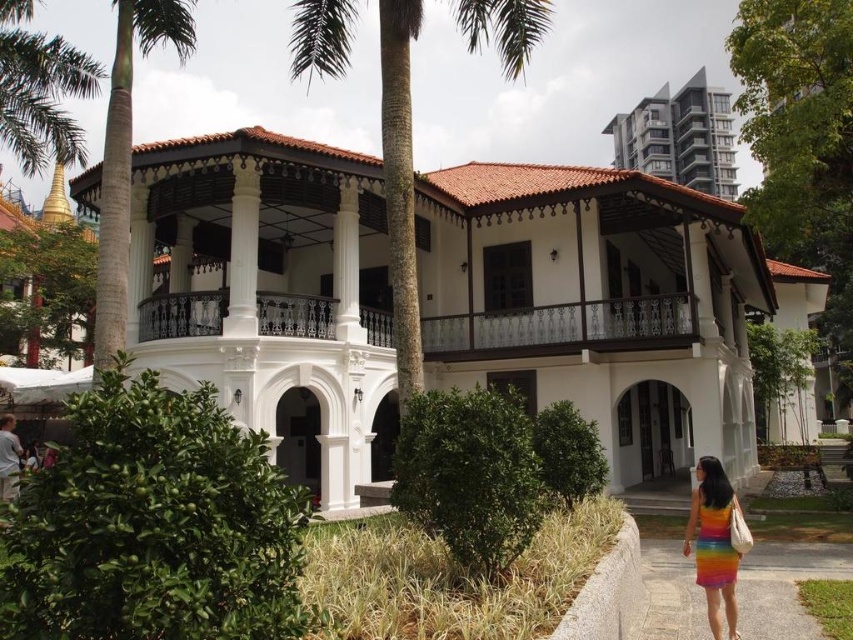
Is green leafy palm tree at center bigger than green leafy palm tree at left?

Yes, green leafy palm tree at center is bigger than green leafy palm tree at left.

Is green leafy palm tree at center wider than green leafy palm tree at left?

Correct, the width of green leafy palm tree at center exceeds that of green leafy palm tree at left.

Describe the element at coordinates (399, 186) in the screenshot. I see `green leafy palm tree at center` at that location.

Identify the location of green leafy palm tree at center. (399, 186).

Does green leafy palm tree at upper left have a lesser height compared to matte gray building at upper right?

In fact, green leafy palm tree at upper left may be taller than matte gray building at upper right.

The height and width of the screenshot is (640, 853). What do you see at coordinates (39, 90) in the screenshot? I see `green leafy palm tree at upper left` at bounding box center [39, 90].

Where is `green leafy palm tree at upper left`? The width and height of the screenshot is (853, 640). green leafy palm tree at upper left is located at coordinates (39, 90).

Describe the element at coordinates (399, 186) in the screenshot. The image size is (853, 640). I see `green leafy palm tree at center` at that location.

Can you confirm if green leafy palm tree at center is bigger than matte gray building at upper right?

Indeed, green leafy palm tree at center has a larger size compared to matte gray building at upper right.

Image resolution: width=853 pixels, height=640 pixels. Find the location of `green leafy palm tree at center`. green leafy palm tree at center is located at coordinates (399, 186).